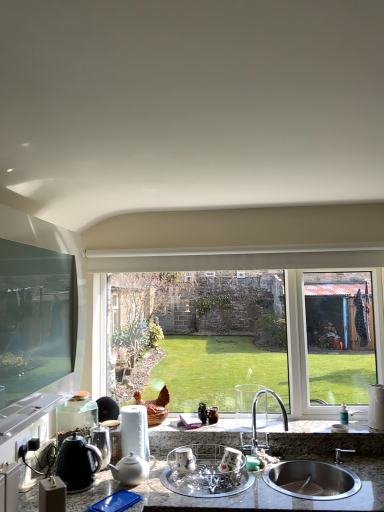
Question: Considering the relative positions of black matte tea pot at lower left, positioned as the 1th tea pot in left-to-right order, and satin nickel faucet at center in the image provided, is black matte tea pot at lower left, positioned as the 1th tea pot in left-to-right order, to the left of satin nickel faucet at center from the viewer's perspective?

Choices:
 (A) yes
 (B) no

Answer: (A)

Question: From a real-world perspective, is black matte tea pot at lower left, positioned as the 1th tea pot in left-to-right order, positioned under satin nickel faucet at center based on gravity?

Choices:
 (A) yes
 (B) no

Answer: (A)

Question: From the image's perspective, would you say black matte tea pot at lower left, positioned as the 1th tea pot in left-to-right order, is shown under satin nickel faucet at center?

Choices:
 (A) yes
 (B) no

Answer: (A)

Question: Can you confirm if black matte tea pot at lower left, which is the second tea pot in right-to-left order, is bigger than satin nickel faucet at center?

Choices:
 (A) yes
 (B) no

Answer: (B)

Question: Is black matte tea pot at lower left, positioned as the 1th tea pot in left-to-right order, facing towards satin nickel faucet at center?

Choices:
 (A) yes
 (B) no

Answer: (B)

Question: Considering the positions of white ceramic vase at right, placed as the third appliance when sorted from left to right, and satin nickel faucet at center in the image, is white ceramic vase at right, placed as the third appliance when sorted from left to right, taller or shorter than satin nickel faucet at center?

Choices:
 (A) tall
 (B) short

Answer: (B)

Question: Visually, is white ceramic vase at right, placed as the third appliance when sorted from left to right, positioned to the left or to the right of satin nickel faucet at center?

Choices:
 (A) left
 (B) right

Answer: (B)

Question: Is white ceramic vase at right, the 1th appliance from the back, wider or thinner than satin nickel faucet at center?

Choices:
 (A) wide
 (B) thin

Answer: (B)

Question: In terms of size, does white ceramic vase at right, placed as the third appliance when sorted from left to right, appear bigger or smaller than satin nickel faucet at center?

Choices:
 (A) small
 (B) big

Answer: (A)

Question: Is granite gray countertop at lower center wider or thinner than shiny metallic kettle at lower left, the 1th appliance positioned from the left?

Choices:
 (A) thin
 (B) wide

Answer: (B)

Question: Does point (157, 449) appear closer or farther from the camera than point (102, 458)?

Choices:
 (A) closer
 (B) farther

Answer: (B)

Question: Choose the correct answer: Is granite gray countertop at lower center inside shiny metallic kettle at lower left, the 1th appliance positioned from the left, or outside it?

Choices:
 (A) outside
 (B) inside

Answer: (A)

Question: From a real-world perspective, relative to shiny metallic kettle at lower left, the 1th appliance positioned from the left, is granite gray countertop at lower center vertically above or below?

Choices:
 (A) above
 (B) below

Answer: (B)

Question: From the image's perspective, is white ceramic vase at right, the first appliance from the right, positioned above or below granite gray countertop at lower center?

Choices:
 (A) above
 (B) below

Answer: (A)

Question: From their relative heights in the image, would you say white ceramic vase at right, which ranks as the 3th appliance in front-to-back order, is taller or shorter than granite gray countertop at lower center?

Choices:
 (A) short
 (B) tall

Answer: (A)